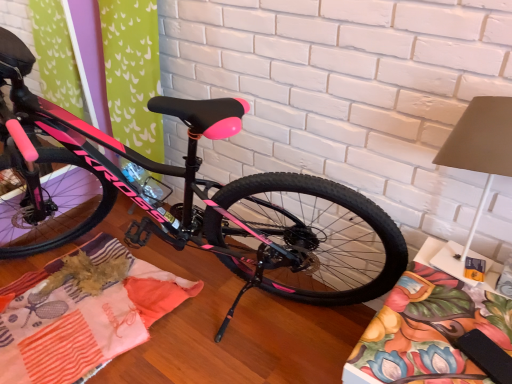
What are the coordinates of `vacant area on top of floral fabric cushion at lower right, arranged as the first blanket when viewed from the right (from a real-world perspective)` in the screenshot? It's located at (454, 320).